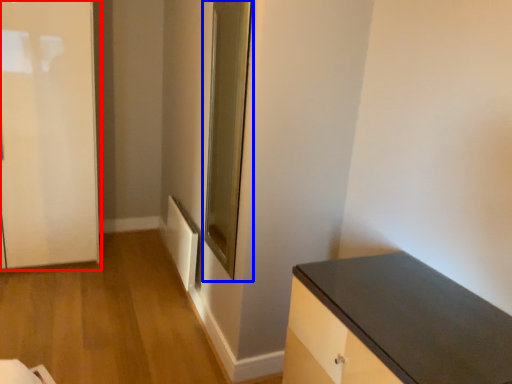
Question: Among these objects, which one is farthest to the camera, door (highlighted by a red box) or glass door (highlighted by a blue box)?

Choices:
 (A) door
 (B) glass door

Answer: (A)